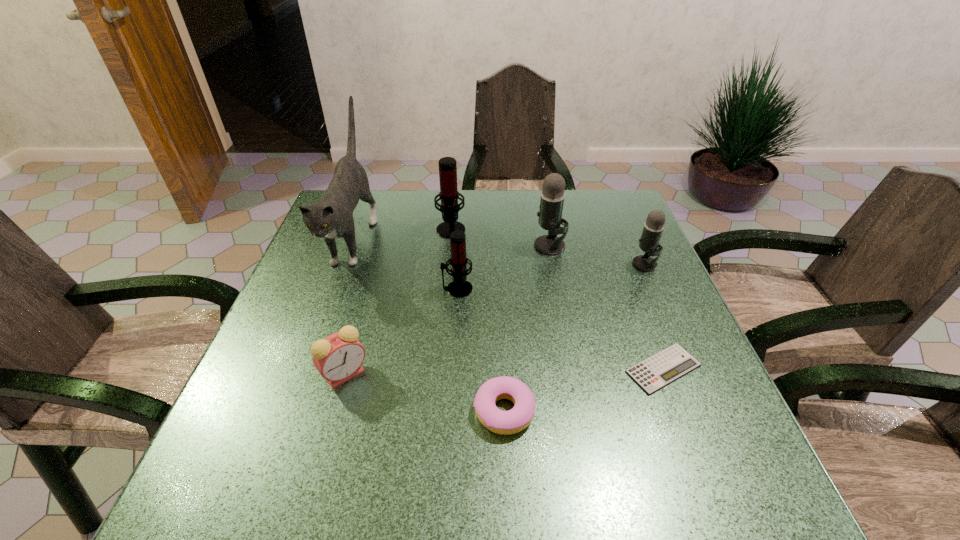
In the image, there is a desktop. At what (x,y) coordinates should I click in order to perform the action: click on vacant space at the left edge. Please return your answer as a coordinate pair (x, y). Looking at the image, I should click on (275, 365).

In the image, there is a desktop. Find the location of `vacant space at the right edge`. vacant space at the right edge is located at coordinates (607, 289).

Locate an element on the screen. This screenshot has width=960, height=540. vacant space at the far right corner of the desktop is located at coordinates (628, 226).

The image size is (960, 540). What are the coordinates of `blank region between the cat and the bigger red microphone` in the screenshot? It's located at (402, 233).

The image size is (960, 540). I want to click on free space between the bigger red microphone and the second shortest object, so click(x=477, y=319).

Locate an element on the screen. Image resolution: width=960 pixels, height=540 pixels. free area in between the doughnut and the right gray microphone is located at coordinates pos(574,338).

I want to click on empty space between the nearest microphone and the doughnut, so click(x=480, y=350).

Locate an element on the screen. The width and height of the screenshot is (960, 540). vacant space that's between the tallest object and the shortest object is located at coordinates (509, 302).

What are the coordinates of `free space between the third shortest object and the smaller gray microphone` in the screenshot? It's located at (495, 319).

I want to click on blank region between the sixth tallest object and the doughnut, so click(424, 392).